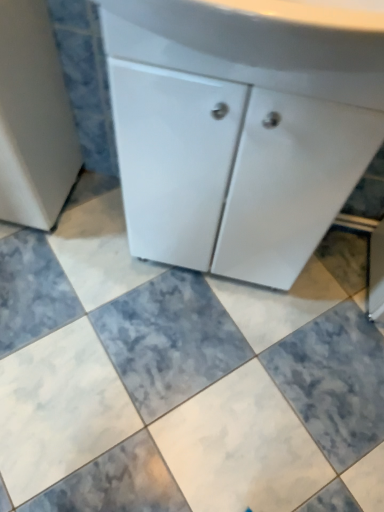
Where is `vacant area that is situated to the right of white glossy cabinet at center`? vacant area that is situated to the right of white glossy cabinet at center is located at coordinates (329, 301).